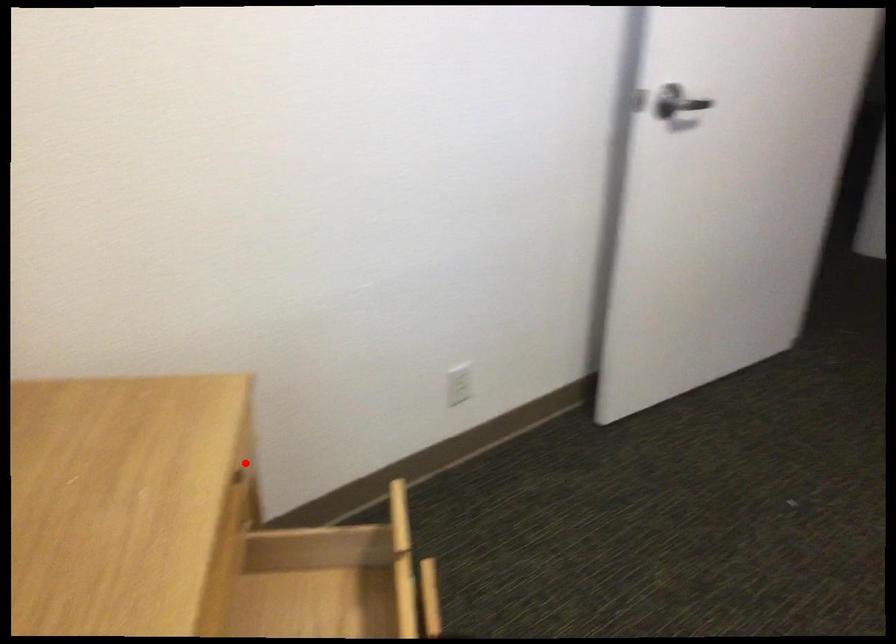
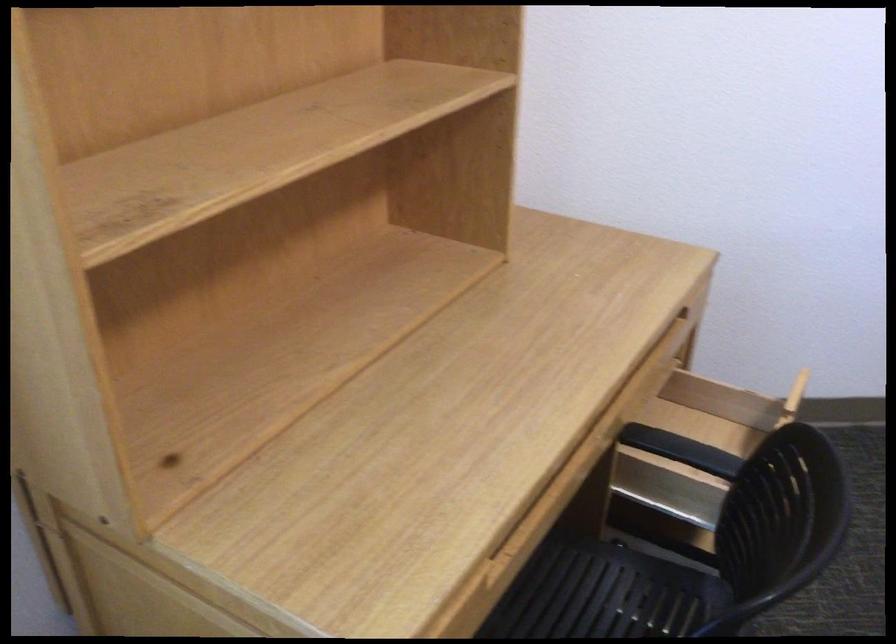
Locate, in the second image, the point that corresponds to the highlighted location in the first image.

(691, 313)